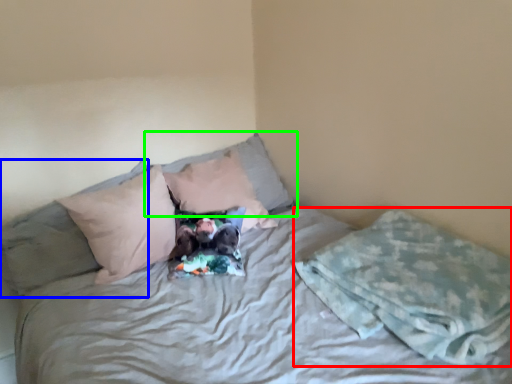
Question: Which object is the farthest from blanket (highlighted by a red box)? Choose among these: pillow (highlighted by a blue box) or pillow (highlighted by a green box).

Choices:
 (A) pillow
 (B) pillow

Answer: (A)